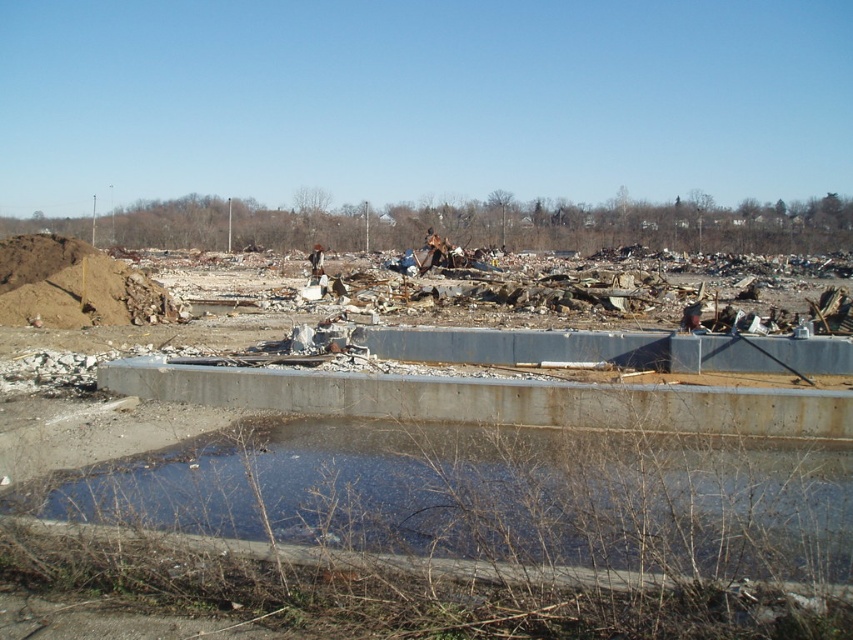
Is concrete debris at center above clear concrete water at center?

Indeed, concrete debris at center is positioned over clear concrete water at center.

From the picture: Which of these two, concrete debris at center or clear concrete water at center, stands taller?

Standing taller between the two is concrete debris at center.

This screenshot has width=853, height=640. I want to click on concrete debris at center, so click(457, 513).